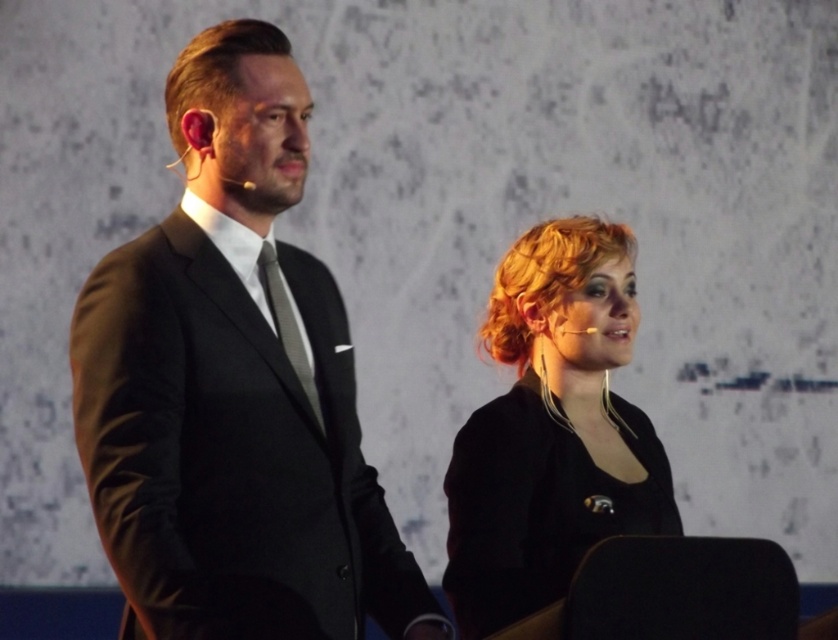
You are an event planner and need to place a name tag on the person at the point labeled as point [233,387]. Which person should you place it on?

The point [233,387] is on the matte black suit at left, so you should place the name tag on the person on the left.

You are attending a formal event and need to find the taller individual between the matte black suit at left and the blonde hair at lower right. Which one should you look for?

The matte black suit at left is much taller than the blonde hair at lower right, so you should look for the matte black suit at left.